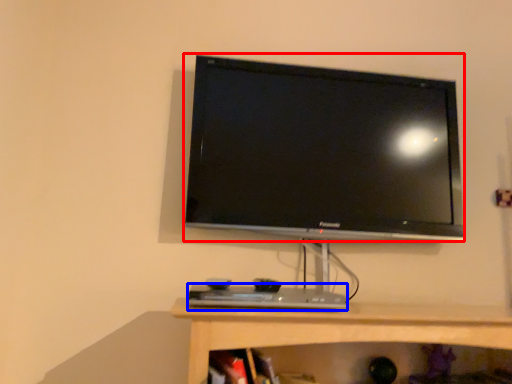
Question: Among these objects, which one is nearest to the camera, television (highlighted by a red box) or desktop (highlighted by a blue box)?

Choices:
 (A) television
 (B) desktop

Answer: (B)